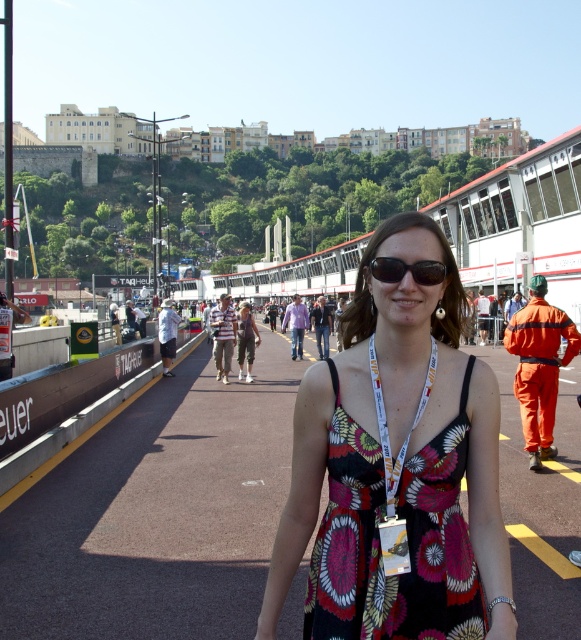
Question: Observing the image, what is the correct spatial positioning of floral dress at center in reference to floral fabric dress at center?

Choices:
 (A) right
 (B) left

Answer: (A)

Question: Which of these objects is positioned farthest from the floral dress at center?

Choices:
 (A) black asphalt at center
 (B) floral fabric dress at center

Answer: (B)

Question: Is black asphalt at center further to camera compared to floral dress at center?

Choices:
 (A) no
 (B) yes

Answer: (B)

Question: Which of these objects is positioned farthest from the black plastic sunglasses at center?

Choices:
 (A) floral fabric dress at center
 (B) floral dress at center
 (C) printed fabric dress at center

Answer: (A)

Question: Is printed fabric dress at center below black plastic sunglasses at center?

Choices:
 (A) no
 (B) yes

Answer: (B)

Question: Which point is closer to the camera?

Choices:
 (A) printed fabric dress at center
 (B) floral dress at center

Answer: (B)